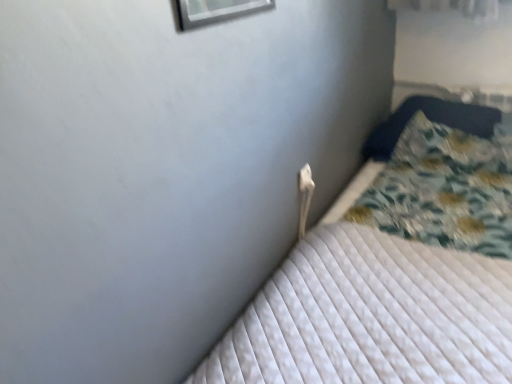
Where is `white plastic electric outlet at upper center`? Image resolution: width=512 pixels, height=384 pixels. white plastic electric outlet at upper center is located at coordinates (305, 179).

Locate an element on the screen. The height and width of the screenshot is (384, 512). fluffy blue pillow at right is located at coordinates (430, 120).

You are a GUI agent. You are given a task and a screenshot of the screen. Output one action in this format:
    pyautogui.click(x=<x>, y=<y>)
    Task: Click on the white quilted mattress at center
    This screenshot has width=512, height=384.
    Given the screenshot: What is the action you would take?
    pyautogui.click(x=395, y=267)

Is fluffy blue pillow at right inside or outside of white plastic electric outlet at upper center?

fluffy blue pillow at right is not enclosed by white plastic electric outlet at upper center.

Which object is more forward, fluffy blue pillow at right or white plastic electric outlet at upper center?

white plastic electric outlet at upper center is closer to the camera.

Which object is thinner, fluffy blue pillow at right or white plastic electric outlet at upper center?

Thinner between the two is white plastic electric outlet at upper center.

Based on their sizes in the image, would you say fluffy blue pillow at right is bigger or smaller than white plastic electric outlet at upper center?

Considering their sizes, fluffy blue pillow at right takes up more space than white plastic electric outlet at upper center.

Does white plastic electric outlet at upper center have a larger size compared to white quilted mattress at center?

No, white plastic electric outlet at upper center is not bigger than white quilted mattress at center.

Is white plastic electric outlet at upper center inside the boundaries of white quilted mattress at center, or outside?

white plastic electric outlet at upper center is not inside white quilted mattress at center, it's outside.

Is white plastic electric outlet at upper center next to white quilted mattress at center and touching it?

They are not placed beside each other.

Is white plastic electric outlet at upper center to the left of white quilted mattress at center from the viewer's perspective?

Indeed, white plastic electric outlet at upper center is positioned on the left side of white quilted mattress at center.

Does white quilted mattress at center have a smaller size compared to white plastic electric outlet at upper center?

No, white quilted mattress at center is not smaller than white plastic electric outlet at upper center.

Is point (489, 248) closer to viewer compared to point (300, 171)?

Yes, it is in front of point (300, 171).

Which is correct: white quilted mattress at center is inside white plastic electric outlet at upper center, or outside of it?

white quilted mattress at center exists outside the volume of white plastic electric outlet at upper center.

Is white plastic electric outlet at upper center bigger than fluffy blue pillow at right?

Incorrect, white plastic electric outlet at upper center is not larger than fluffy blue pillow at right.

Would you consider white plastic electric outlet at upper center to be distant from fluffy blue pillow at right?

They are positioned close to each other.

From a real-world perspective, who is located lower, white plastic electric outlet at upper center or fluffy blue pillow at right?

In real-world perspective, fluffy blue pillow at right is lower.

From the image's perspective, is white plastic electric outlet at upper center located above or below fluffy blue pillow at right?

white plastic electric outlet at upper center is situated lower than fluffy blue pillow at right in the image.

Which of these two, fluffy blue pillow at right or white quilted mattress at center, is smaller?

fluffy blue pillow at right.

The image size is (512, 384). I want to click on pillow behind the white quilted mattress at center, so click(x=430, y=120).

Would you say fluffy blue pillow at right contains white quilted mattress at center?

Definitely not — white quilted mattress at center is not inside fluffy blue pillow at right.

From the image's perspective, is fluffy blue pillow at right positioned above or below white quilted mattress at center?

fluffy blue pillow at right is situated higher than white quilted mattress at center in the image.

Can you confirm if white quilted mattress at center is bigger than fluffy blue pillow at right?

Correct, white quilted mattress at center is larger in size than fluffy blue pillow at right.

From a real-world perspective, is white quilted mattress at center positioned over fluffy blue pillow at right based on gravity?

No, from a real-world perspective, white quilted mattress at center is not above fluffy blue pillow at right.

Image resolution: width=512 pixels, height=384 pixels. Find the location of `electric outlet below the fluffy blue pillow at right (from the image's perspective)`. electric outlet below the fluffy blue pillow at right (from the image's perspective) is located at coordinates (305, 179).

Identify the location of electric outlet above the white quilted mattress at center (from a real-world perspective). (305, 179).

Which object lies further to the anchor point fluffy blue pillow at right, white plastic electric outlet at upper center or white quilted mattress at center?

white plastic electric outlet at upper center lies further to fluffy blue pillow at right than the other object.

Which object lies further to the anchor point white quilted mattress at center, fluffy blue pillow at right or white plastic electric outlet at upper center?

white plastic electric outlet at upper center is positioned further to the anchor white quilted mattress at center.

From the image, which object appears to be nearer to white quilted mattress at center, white plastic electric outlet at upper center or fluffy blue pillow at right?

fluffy blue pillow at right lies closer to white quilted mattress at center than the other object.

Estimate the real-world distances between objects in this image. Which object is closer to fluffy blue pillow at right, white quilted mattress at center or white plastic electric outlet at upper center?

white quilted mattress at center is closer to fluffy blue pillow at right.

Based on their spatial positions, is white quilted mattress at center or fluffy blue pillow at right closer to white plastic electric outlet at upper center?

white quilted mattress at center is positioned closer to the anchor white plastic electric outlet at upper center.

From the image, which object appears to be farther from white plastic electric outlet at upper center, fluffy blue pillow at right or white quilted mattress at center?

Based on the image, fluffy blue pillow at right appears to be further to white plastic electric outlet at upper center.

Identify the location of electric outlet between white quilted mattress at center and fluffy blue pillow at right from front to back. The image size is (512, 384). (305, 179).